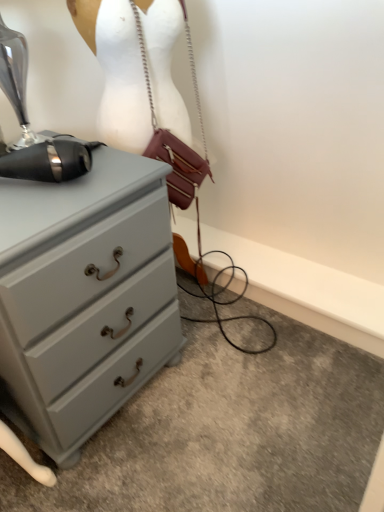
Question: Does leather/metallic handbag at center turn towards white matte mannequin at upper center?

Choices:
 (A) no
 (B) yes

Answer: (B)

Question: From the image's perspective, would you say leather/metallic handbag at center is shown under white matte mannequin at upper center?

Choices:
 (A) yes
 (B) no

Answer: (B)

Question: Can you confirm if leather/metallic handbag at center is shorter than white matte mannequin at upper center?

Choices:
 (A) yes
 (B) no

Answer: (A)

Question: Does leather/metallic handbag at center have a greater width compared to white matte mannequin at upper center?

Choices:
 (A) yes
 (B) no

Answer: (B)

Question: Is leather/metallic handbag at center at the left side of white matte mannequin at upper center?

Choices:
 (A) yes
 (B) no

Answer: (B)

Question: Looking at the image, does white matte mannequin at upper center seem bigger or smaller compared to leather/metallic handbag at center?

Choices:
 (A) big
 (B) small

Answer: (A)

Question: Choose the correct answer: Is white matte mannequin at upper center inside leather/metallic handbag at center or outside it?

Choices:
 (A) inside
 (B) outside

Answer: (B)

Question: From their relative heights in the image, would you say white matte mannequin at upper center is taller or shorter than leather/metallic handbag at center?

Choices:
 (A) short
 (B) tall

Answer: (B)

Question: Would you say white matte mannequin at upper center is to the left or to the right of leather/metallic handbag at center in the picture?

Choices:
 (A) left
 (B) right

Answer: (A)

Question: Choose the correct answer: Is white matte mannequin at upper center inside matte gray chest of drawers at left or outside it?

Choices:
 (A) outside
 (B) inside

Answer: (A)

Question: Based on their positions, is white matte mannequin at upper center located to the left or right of matte gray chest of drawers at left?

Choices:
 (A) right
 (B) left

Answer: (A)

Question: Looking at their shapes, would you say white matte mannequin at upper center is wider or thinner than matte gray chest of drawers at left?

Choices:
 (A) thin
 (B) wide

Answer: (A)

Question: In terms of height, does white matte mannequin at upper center look taller or shorter compared to matte gray chest of drawers at left?

Choices:
 (A) short
 (B) tall

Answer: (B)

Question: From the image's perspective, is leather/metallic handbag at center above or below matte gray chest of drawers at left?

Choices:
 (A) below
 (B) above

Answer: (B)

Question: Is leather/metallic handbag at center wider or thinner than matte gray chest of drawers at left?

Choices:
 (A) wide
 (B) thin

Answer: (B)